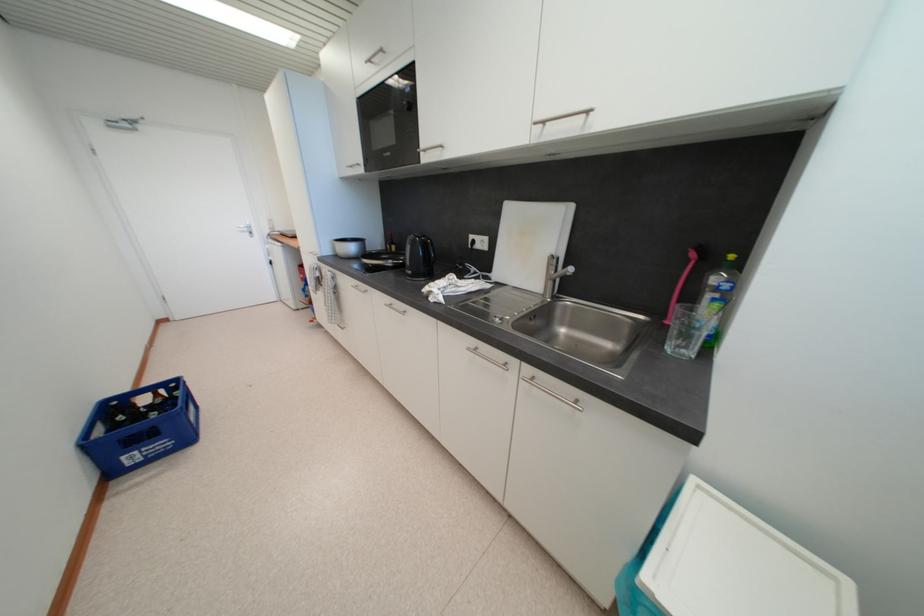
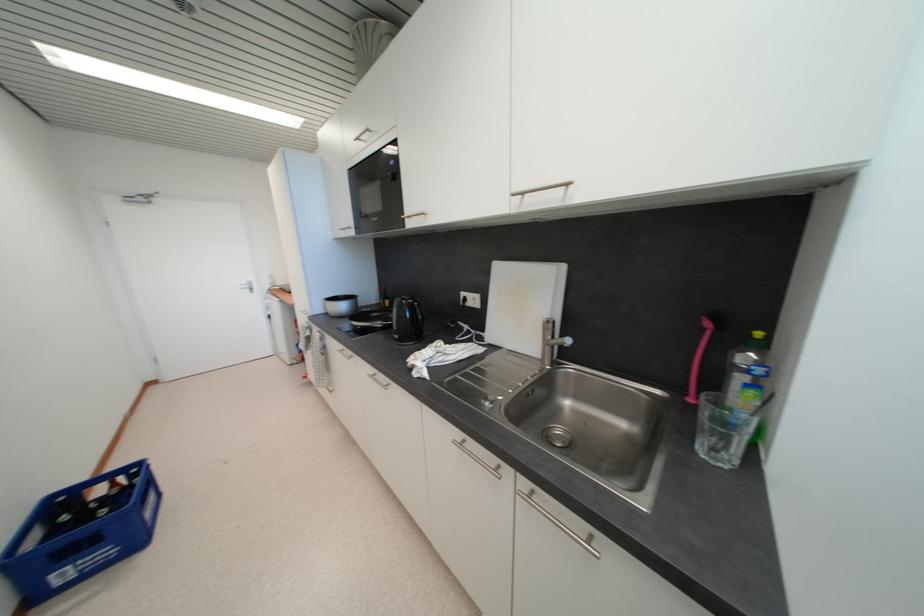
Find the pixel in the second image that matches [360,270] in the first image.

(351, 328)